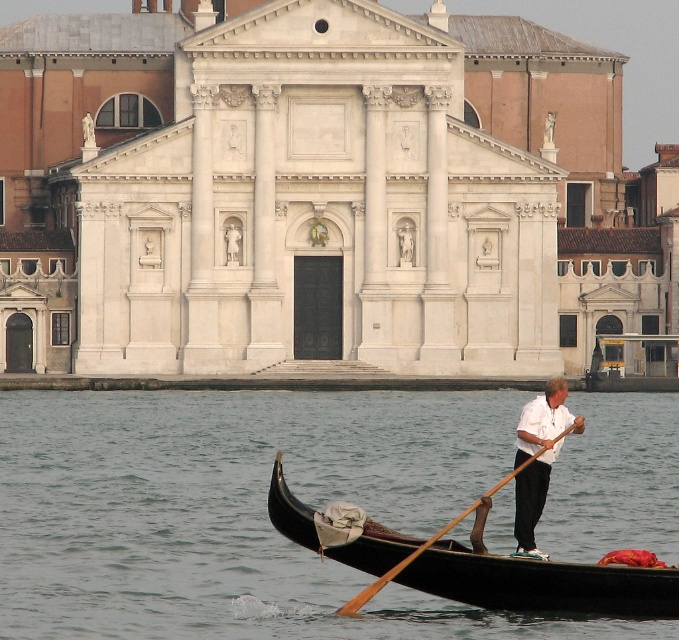
Question: Considering the relative positions of white cotton shirt at center and brown wood paddle at lower center in the image provided, where is white cotton shirt at center located with respect to brown wood paddle at lower center?

Choices:
 (A) right
 (B) left

Answer: (A)

Question: Which point is closer to the camera?

Choices:
 (A) (479, 499)
 (B) (120, 413)
 (C) (576, 419)

Answer: (C)

Question: Can you confirm if white cotton shirt at center is positioned below brown wood paddle at lower center?

Choices:
 (A) no
 (B) yes

Answer: (A)

Question: Can you confirm if white cotton shirt at center is smaller than brown wood paddle at lower center?

Choices:
 (A) no
 (B) yes

Answer: (B)

Question: Which point is farther from the camera taking this photo?

Choices:
 (A) [1, 516]
 (B) [401, 568]

Answer: (A)

Question: Based on their relative distances, which object is farther from the transparent water at lower center?

Choices:
 (A) white cotton shirt at center
 (B) brown wood paddle at lower center

Answer: (B)